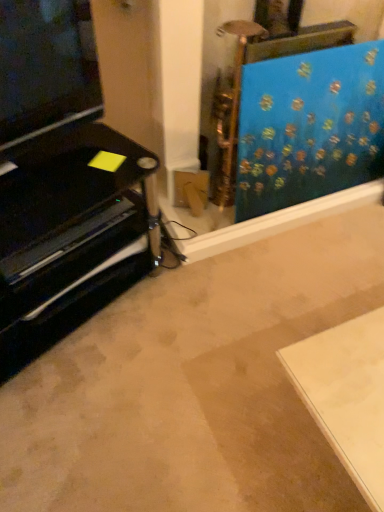
The width and height of the screenshot is (384, 512). In order to click on unoccupied area in front of blue fabric at upper right in this screenshot , I will do `click(301, 262)`.